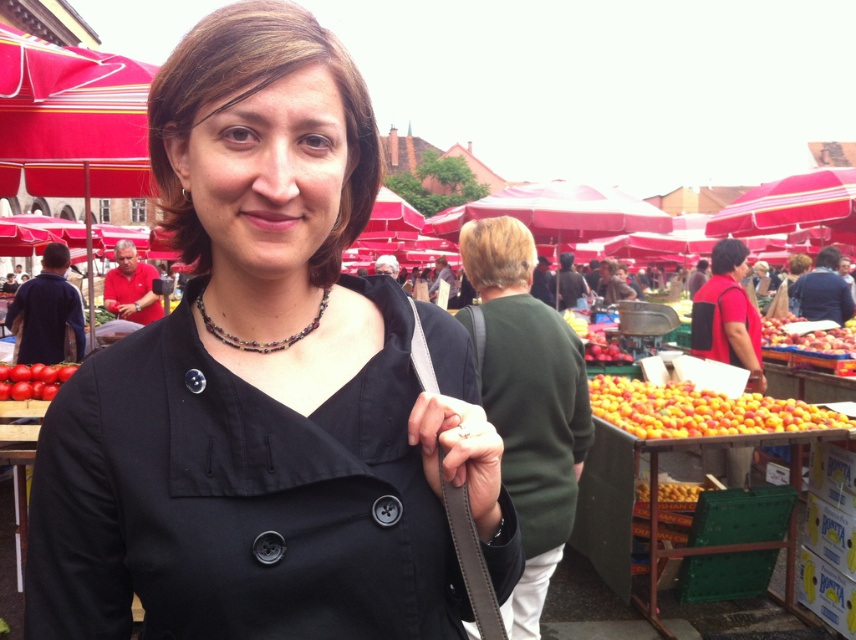
Question: Estimate the real-world distances between objects in this image. Which object is farther from the matte red shirt at right?

Choices:
 (A) yellow matte peaches at right
 (B) shiny red tomato at lower left

Answer: (B)

Question: Which object is positioned farthest from the red fabric vendor at left?

Choices:
 (A) shiny red tomato at lower left
 (B) black matte coat at center

Answer: (B)

Question: Is red matte apples at right in front of multicolored beaded necklace at center?

Choices:
 (A) yes
 (B) no

Answer: (B)

Question: Does matte red shirt at right have a smaller size compared to multicolored beaded necklace at center?

Choices:
 (A) yes
 (B) no

Answer: (B)

Question: Does matte red shirt at right have a greater width compared to red matte apples at right?

Choices:
 (A) yes
 (B) no

Answer: (B)

Question: Estimate the real-world distances between objects in this image. Which object is farther from the red fabric vendor at left?

Choices:
 (A) shiny red tomato at lower left
 (B) multicolored beaded necklace at center
 (C) black matte coat at center

Answer: (B)